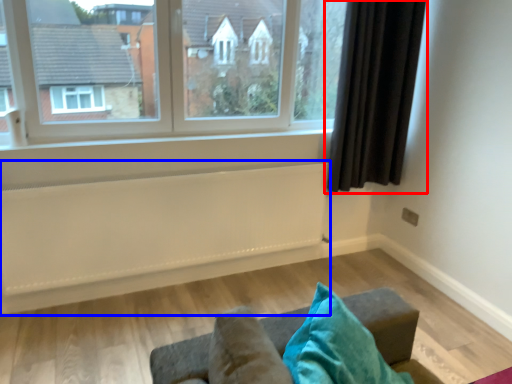
Question: Which object is closer to the camera taking this photo, curtain (highlighted by a red box) or radiator (highlighted by a blue box)?

Choices:
 (A) curtain
 (B) radiator

Answer: (B)